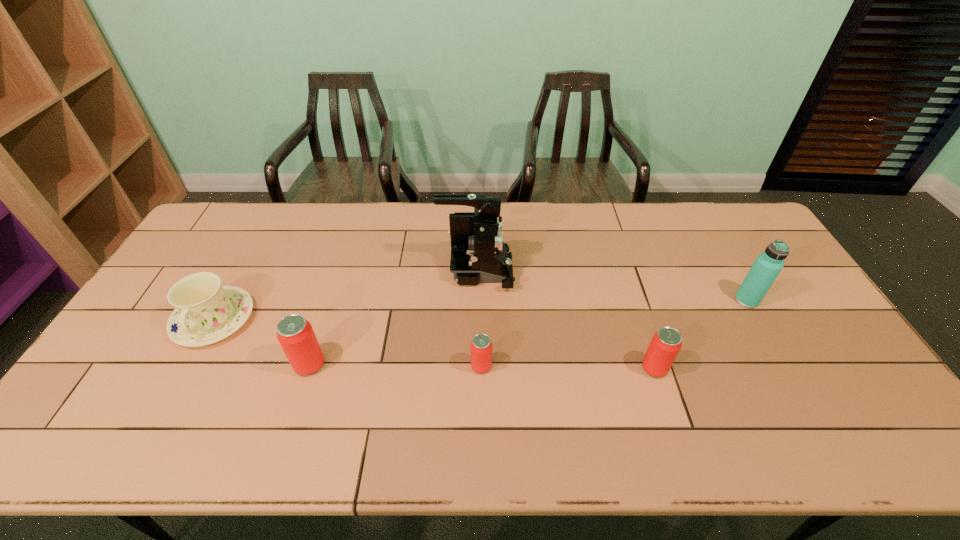
Find the location of a particular element. The image size is (960, 540). vacant space that satisfies the following two spatial constraints: 1. on the back side of the fifth shortest object; 2. on the right side of the rightmost beer can is located at coordinates (633, 300).

Find the location of a particular element. This screenshot has height=540, width=960. free space in the image that satisfies the following two spatial constraints: 1. on the lens mount of the camcorder; 2. on the handle side of the leftmost object is located at coordinates (475, 319).

Where is `free space that satisfies the following two spatial constraints: 1. on the back side of the second tallest object; 2. on the left side of the fifth object from right to left`? free space that satisfies the following two spatial constraints: 1. on the back side of the second tallest object; 2. on the left side of the fifth object from right to left is located at coordinates (330, 300).

At what (x,y) coordinates should I click in order to perform the action: click on free space in the image that satisfies the following two spatial constraints: 1. on the back side of the second tallest object; 2. on the right side of the second beer can from left to right. Please return your answer as a coordinate pair (x, y). This screenshot has width=960, height=540. Looking at the image, I should click on (481, 300).

The width and height of the screenshot is (960, 540). Identify the location of free space that satisfies the following two spatial constraints: 1. on the handle side of the chinaware; 2. on the left side of the fifth object from left to right. (187, 368).